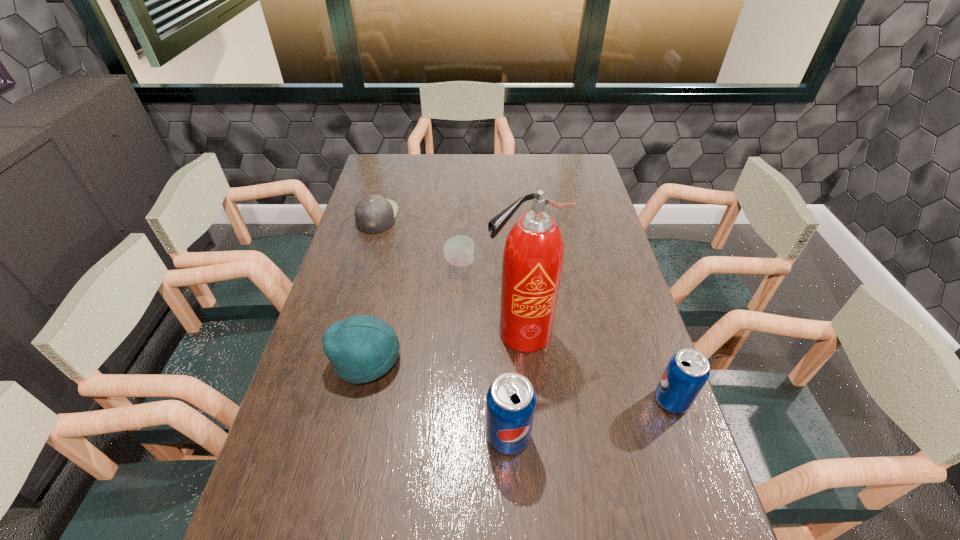
Locate an element on the screen. free location located 0.400m on the left of the rightmost object is located at coordinates (492, 401).

Find the location of a particular element. The width and height of the screenshot is (960, 540). vacant region located on the brim of the cap is located at coordinates (475, 217).

The image size is (960, 540). What are the coordinates of `free space located 0.240m on the front of the second farthest object` in the screenshot? It's located at click(x=456, y=332).

You are a GUI agent. You are given a task and a screenshot of the screen. Output one action in this format:
    pyautogui.click(x=<x>, y=<y>)
    Task: Click on the free location located 0.130m on the back of the third shortest object
    This screenshot has height=540, width=960.
    Given the screenshot: What is the action you would take?
    pyautogui.click(x=379, y=300)

The width and height of the screenshot is (960, 540). I want to click on free spot located 0.390m on the back of the tallest object, so click(513, 231).

Locate an element on the screen. Image resolution: width=960 pixels, height=540 pixels. cap located at the left edge is located at coordinates (373, 214).

Find the location of `beanie that is positioned at the left edge`. beanie that is positioned at the left edge is located at coordinates (361, 348).

The image size is (960, 540). What are the coordinates of `object at the right edge` in the screenshot? It's located at (688, 370).

Where is `free space at the far edge of the desktop`? The height and width of the screenshot is (540, 960). free space at the far edge of the desktop is located at coordinates (514, 168).

Locate an element on the screen. The image size is (960, 540). vacant region at the near edge is located at coordinates (458, 507).